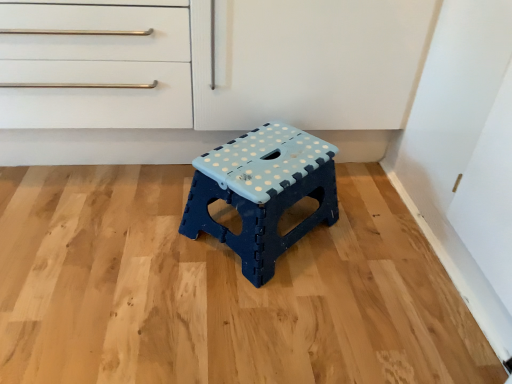
The height and width of the screenshot is (384, 512). I want to click on vacant space in front of blue plastic stool at center, so click(x=249, y=321).